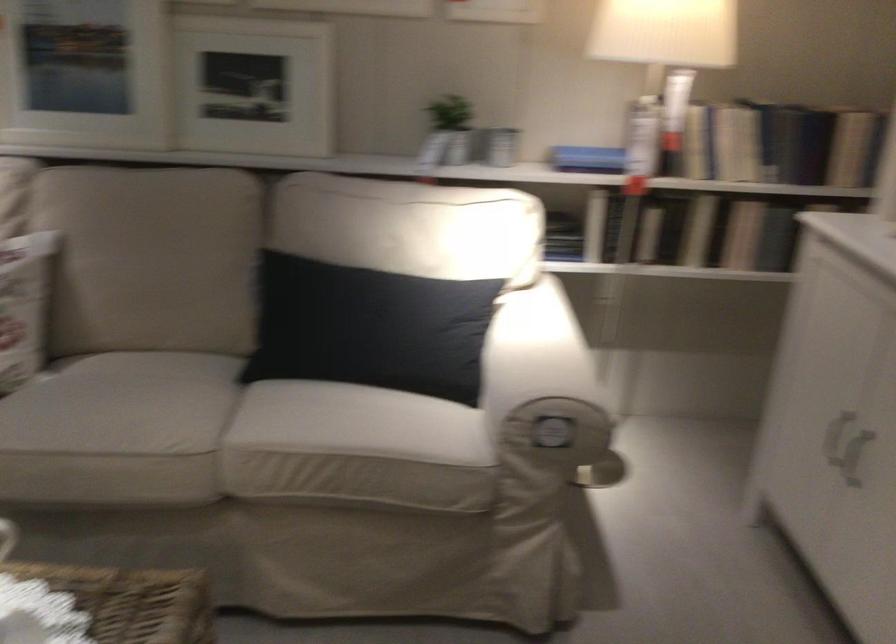
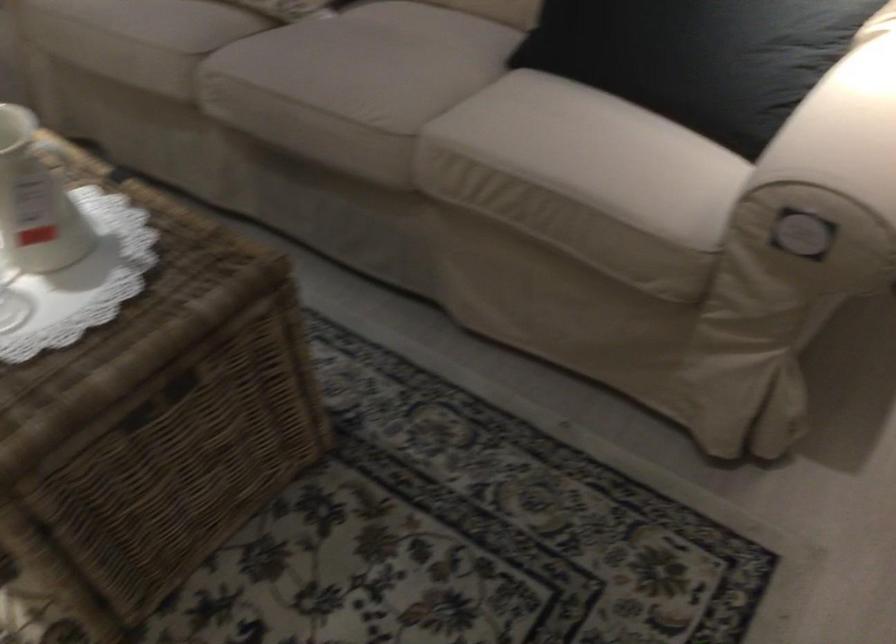
The first image is from the beginning of the video and the second image is from the end. How did the camera likely rotate when shooting the video?

The camera rotated toward left-down.